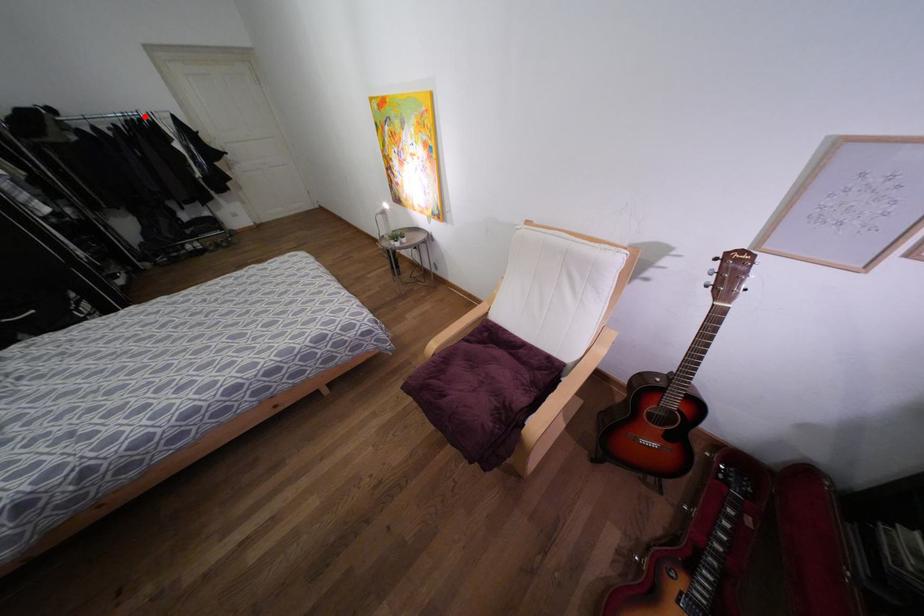
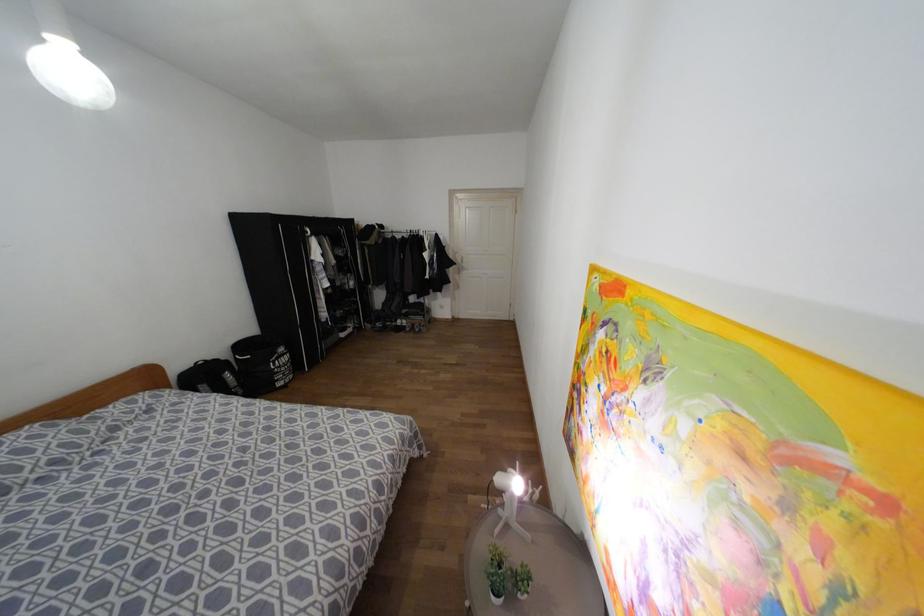
Question: I am providing you with two images of the same scene from different viewpoints. Image1 has a red point marked. In image2, the corresponding 3D location appears at what relative position? Reply with the corresponding letter.

Choices:
 (A) Closer
 (B) Farther

Answer: (A)